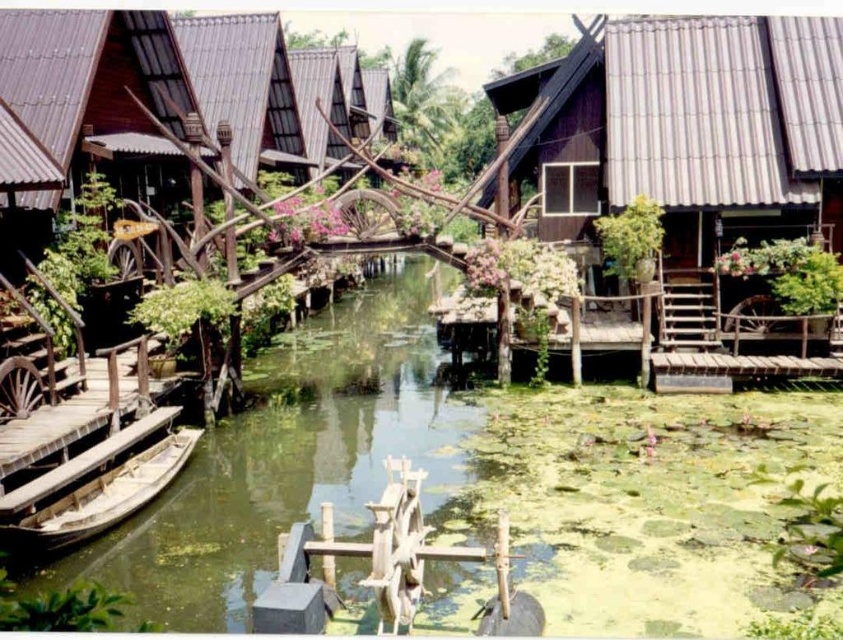
Who is more distant from viewer, [196,502] or [149,461]?

The point [149,461] is more distant.

This screenshot has width=843, height=640. What do you see at coordinates (291, 461) in the screenshot? I see `green algae-covered water at center` at bounding box center [291, 461].

Find the location of `green algae-covered water at center`. green algae-covered water at center is located at coordinates (291, 461).

Does dark brown wood hut at upper right have a greater width compared to wooden hut at center?

Correct, the width of dark brown wood hut at upper right exceeds that of wooden hut at center.

Which of these two, dark brown wood hut at upper right or wooden hut at center, stands shorter?

dark brown wood hut at upper right

Describe the element at coordinates (690, 129) in the screenshot. This screenshot has height=640, width=843. I see `dark brown wood hut at upper right` at that location.

Locate an element on the screen. This screenshot has width=843, height=640. dark brown wood hut at upper right is located at coordinates (690, 129).

Is wooden hut at center bigger than wooden boat at lower left?

Yes, wooden hut at center is bigger than wooden boat at lower left.

Which is more to the right, wooden hut at center or wooden boat at lower left?

wooden hut at center is more to the right.

At what (x,y) coordinates should I click in order to perform the action: click on wooden hut at center. Please return your answer as a coordinate pair (x, y). The height and width of the screenshot is (640, 843). Looking at the image, I should click on (339, 99).